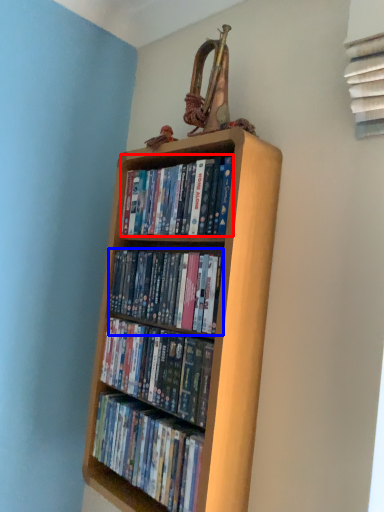
Question: Which of the following is the closest to the observer, book (highlighted by a red box) or book (highlighted by a blue box)?

Choices:
 (A) book
 (B) book

Answer: (B)